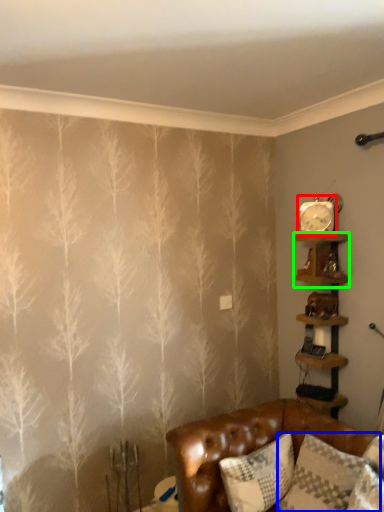
Question: Based on their relative distances, which object is farther from clock (highlighted by a red box)? Choose from pillow (highlighted by a blue box) and shelf (highlighted by a green box).

Choices:
 (A) pillow
 (B) shelf

Answer: (A)